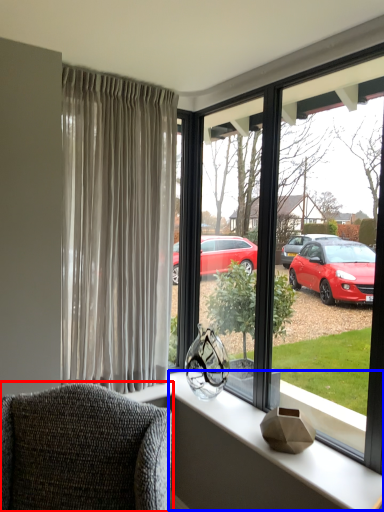
Question: Which object is further to the camera taking this photo, chair (highlighted by a red box) or window sill (highlighted by a blue box)?

Choices:
 (A) chair
 (B) window sill

Answer: (B)